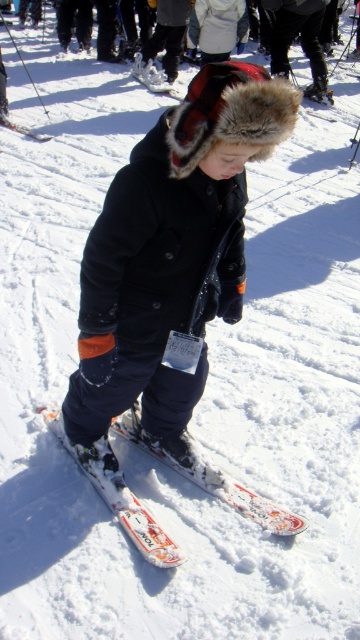
Find the location of a particular element. dark blue fleece jacket at center is located at coordinates (169, 253).

Which is behind, point (203, 380) or point (1, 115)?

Positioned behind is point (1, 115).

The height and width of the screenshot is (640, 360). In order to click on dark blue fleece jacket at center in this screenshot , I will do `click(169, 253)`.

Locate an element on the screen. The height and width of the screenshot is (640, 360). dark blue fleece jacket at center is located at coordinates (169, 253).

Which is more to the right, dark blue fleece jacket at center or white matte ski at center?

dark blue fleece jacket at center is more to the right.

Identify the location of dark blue fleece jacket at center. (169, 253).

Who is more distant from viewer, (137,60) or (0,115)?

The point (137,60) is behind.

Find the location of `white matte ski at center`. white matte ski at center is located at coordinates (155, 76).

This screenshot has width=360, height=640. Identify the location of white matte ski at center. (155, 76).